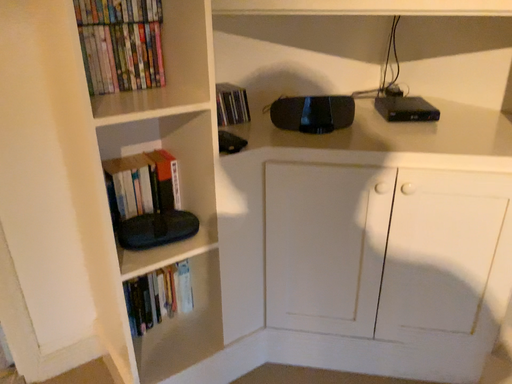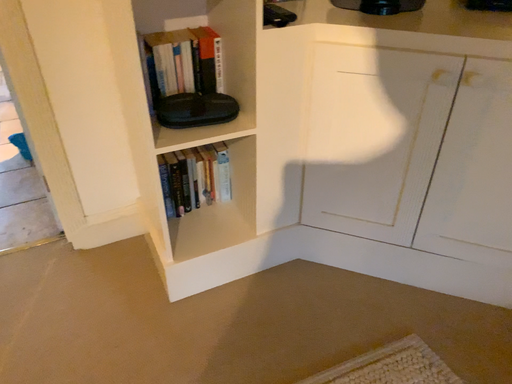
Question: Which way did the camera rotate in the video?

Choices:
 (A) rotated downward
 (B) rotated upward

Answer: (A)